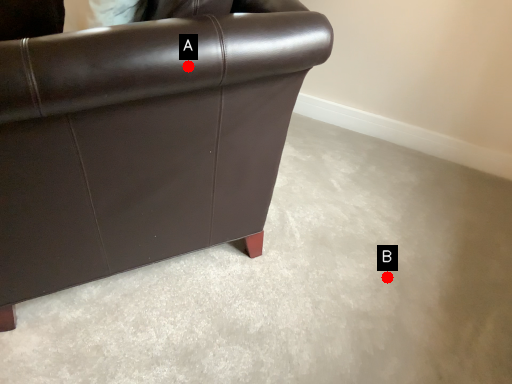
Question: Two points are circled on the image, labeled by A and B beside each circle. Which point is closer to the camera?

Choices:
 (A) A is closer
 (B) B is closer

Answer: (A)